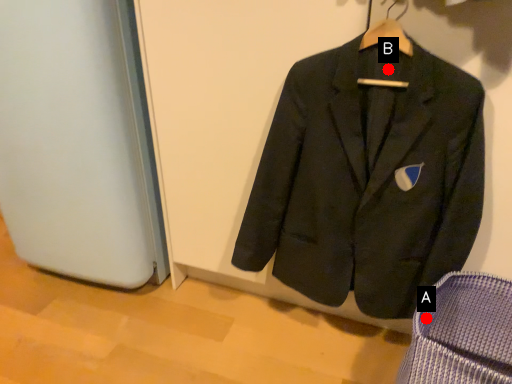
Question: Two points are circled on the image, labeled by A and B beside each circle. Which point is farther from the camera taking this photo?

Choices:
 (A) A is further
 (B) B is further

Answer: (A)